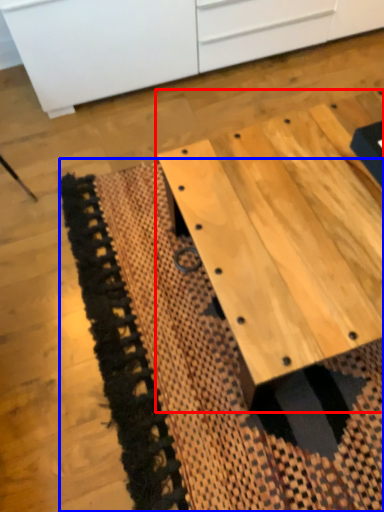
Question: Which object is further to the camera taking this photo, table (highlighted by a red box) or mat (highlighted by a blue box)?

Choices:
 (A) table
 (B) mat

Answer: (B)